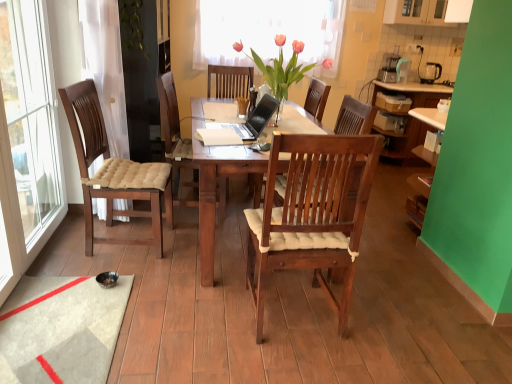
Question: From the image's perspective, is white plastic power outlet at upper right on top of black plastic kettle at upper right?

Choices:
 (A) yes
 (B) no

Answer: (A)

Question: From the image's perspective, is white plastic power outlet at upper right under black plastic kettle at upper right?

Choices:
 (A) yes
 (B) no

Answer: (B)

Question: From a real-world perspective, is white plastic power outlet at upper right located beneath black plastic kettle at upper right?

Choices:
 (A) yes
 (B) no

Answer: (B)

Question: Is white plastic power outlet at upper right bigger than black plastic kettle at upper right?

Choices:
 (A) no
 (B) yes

Answer: (A)

Question: Is white plastic power outlet at upper right behind black plastic kettle at upper right?

Choices:
 (A) no
 (B) yes

Answer: (B)

Question: Looking at the image, does white plastic power outlet at upper right seem bigger or smaller compared to satin black laptop at center?

Choices:
 (A) big
 (B) small

Answer: (B)

Question: Is white plastic power outlet at upper right wider or thinner than satin black laptop at center?

Choices:
 (A) thin
 (B) wide

Answer: (A)

Question: Is white plastic power outlet at upper right to the left or to the right of satin black laptop at center in the image?

Choices:
 (A) right
 (B) left

Answer: (A)

Question: Considering the positions of white plastic power outlet at upper right and satin black laptop at center in the image, is white plastic power outlet at upper right taller or shorter than satin black laptop at center?

Choices:
 (A) short
 (B) tall

Answer: (A)

Question: Is wooden chair at center to the left or to the right of white plastic power outlet at upper right in the image?

Choices:
 (A) right
 (B) left

Answer: (B)

Question: Looking at their shapes, would you say wooden chair at center is wider or thinner than white plastic power outlet at upper right?

Choices:
 (A) wide
 (B) thin

Answer: (A)

Question: Relative to white plastic power outlet at upper right, is wooden chair at center in front or behind?

Choices:
 (A) behind
 (B) front

Answer: (B)

Question: From a real-world perspective, relative to white plastic power outlet at upper right, is wooden chair at center vertically above or below?

Choices:
 (A) below
 (B) above

Answer: (A)

Question: From the image's perspective, relative to translucent fabric at upper center, is white plastic power outlet at upper right above or below?

Choices:
 (A) below
 (B) above

Answer: (A)

Question: Relative to translucent fabric at upper center, is white plastic power outlet at upper right in front or behind?

Choices:
 (A) behind
 (B) front

Answer: (A)